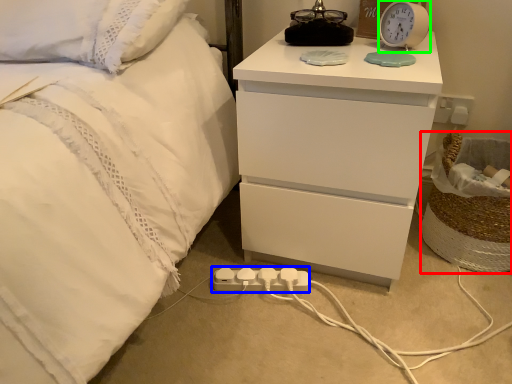
Question: Estimate the real-world distances between objects in this image. Which object is closer to laundry basket (highlighted by a red box), extension cord (highlighted by a blue box) or alarm clock (highlighted by a green box)?

Choices:
 (A) extension cord
 (B) alarm clock

Answer: (B)